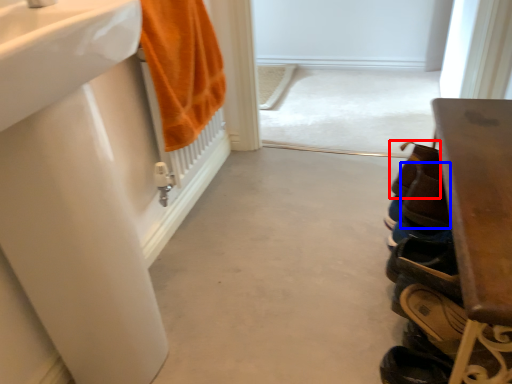
Question: Which object is closer to the camera taking this photo, shoe (highlighted by a red box) or shoe (highlighted by a blue box)?

Choices:
 (A) shoe
 (B) shoe

Answer: (B)